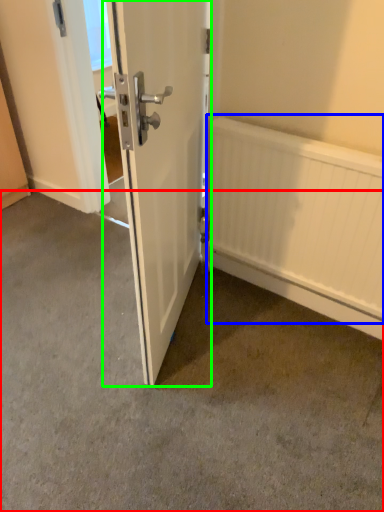
Question: Estimate the real-world distances between objects in this image. Which object is closer to concrete (highlighted by a red box), radiator (highlighted by a blue box) or door (highlighted by a green box)?

Choices:
 (A) radiator
 (B) door

Answer: (B)